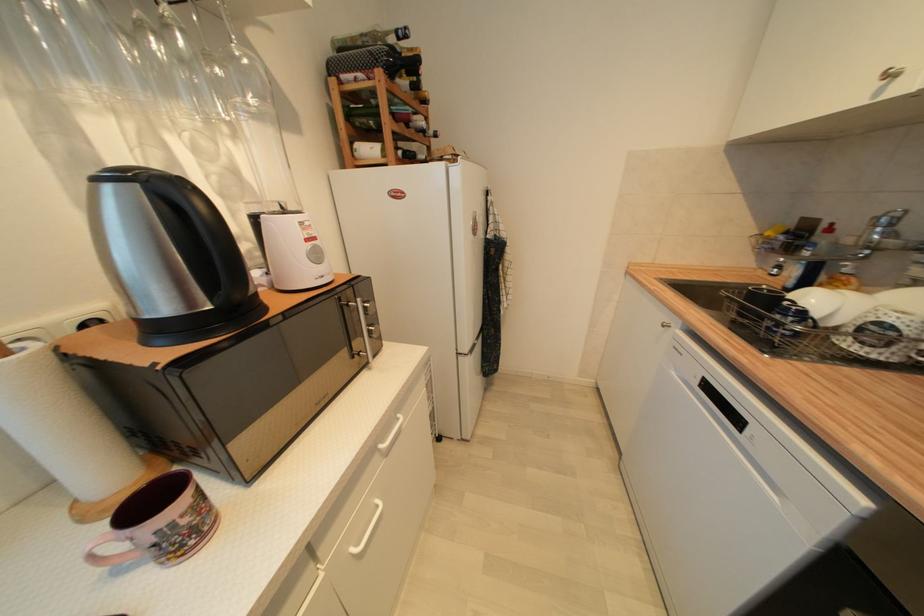
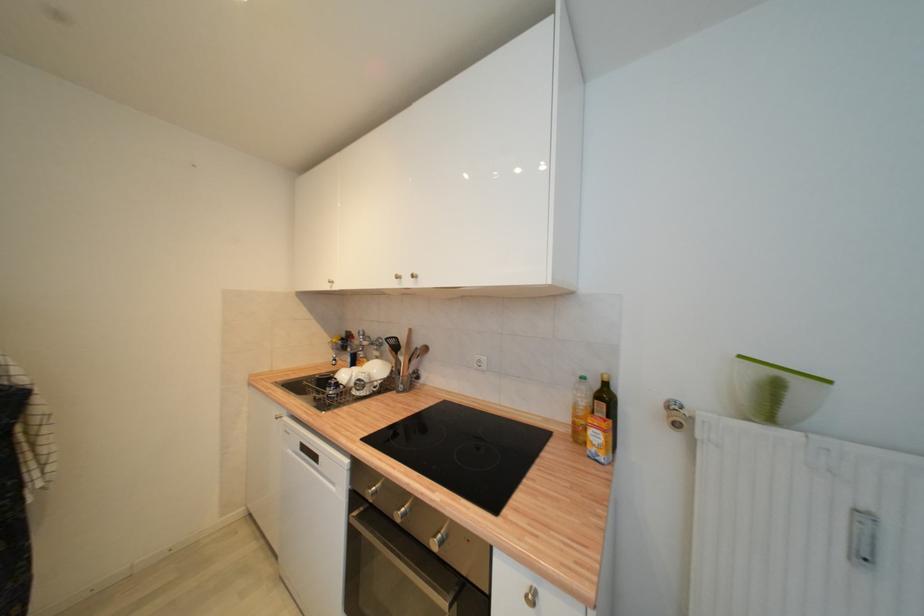
Find the pixel in the second image that matches (x=888, y=326) in the first image.

(363, 382)